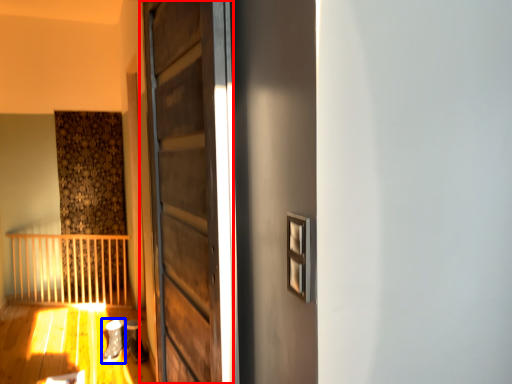
Question: Which point is closer to the camera, door (highlighted by a red box) or shoe (highlighted by a blue box)?

Choices:
 (A) door
 (B) shoe

Answer: (A)